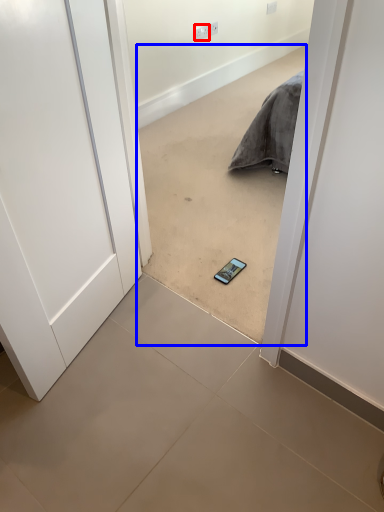
Question: Which object appears farthest to the camera in this image, electric outlet (highlighted by a red box) or concrete (highlighted by a blue box)?

Choices:
 (A) electric outlet
 (B) concrete

Answer: (A)